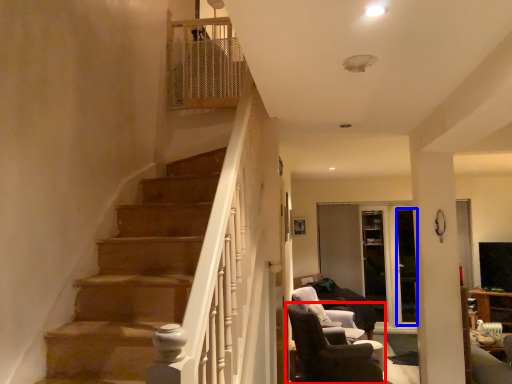
Question: Which of the following is the farthest to the observer, chair (highlighted by a red box) or glass door (highlighted by a blue box)?

Choices:
 (A) chair
 (B) glass door

Answer: (B)